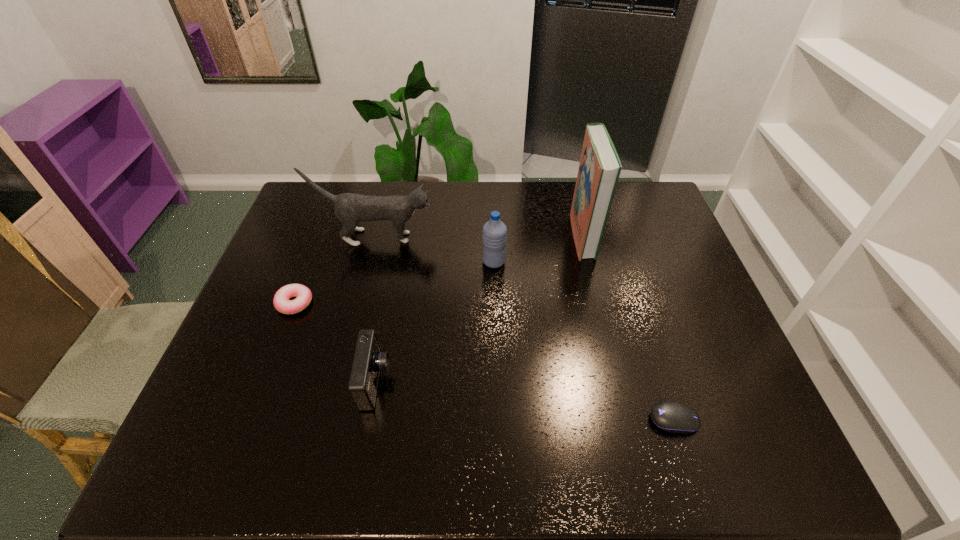
At what (x,y) coordinates should I click in order to perform the action: click on vacant region that satisfies the following two spatial constraints: 1. on the cover of the hardback book; 2. on the left side of the rightmost object. Please return your answer as a coordinate pair (x, y). This screenshot has width=960, height=540. Looking at the image, I should click on (628, 420).

The image size is (960, 540). I want to click on free location that satisfies the following two spatial constraints: 1. on the back side of the computer mouse; 2. at the face of the second tallest object, so click(x=615, y=238).

This screenshot has width=960, height=540. I want to click on vacant space that satisfies the following two spatial constraints: 1. on the front-facing side of the computer mouse; 2. on the left side of the camera, so click(x=369, y=420).